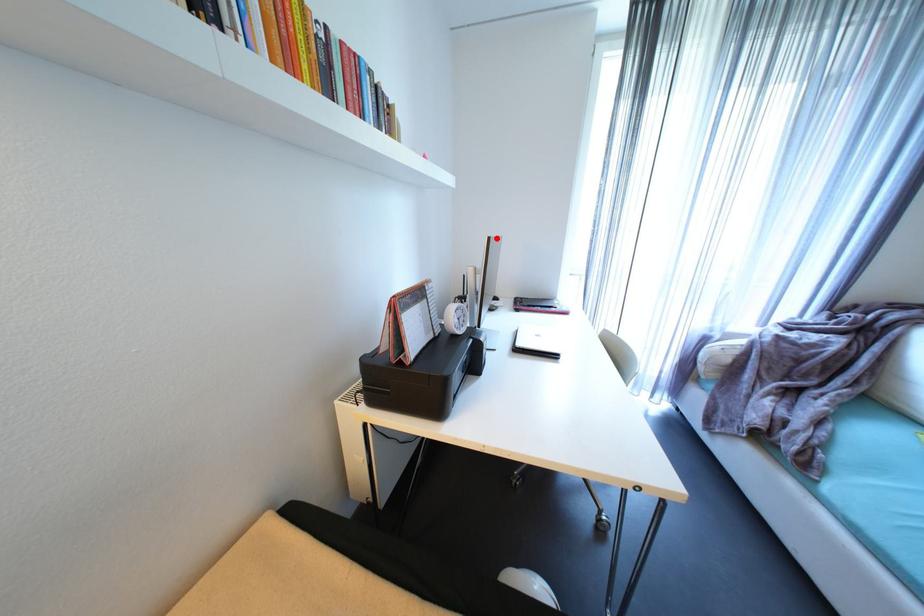
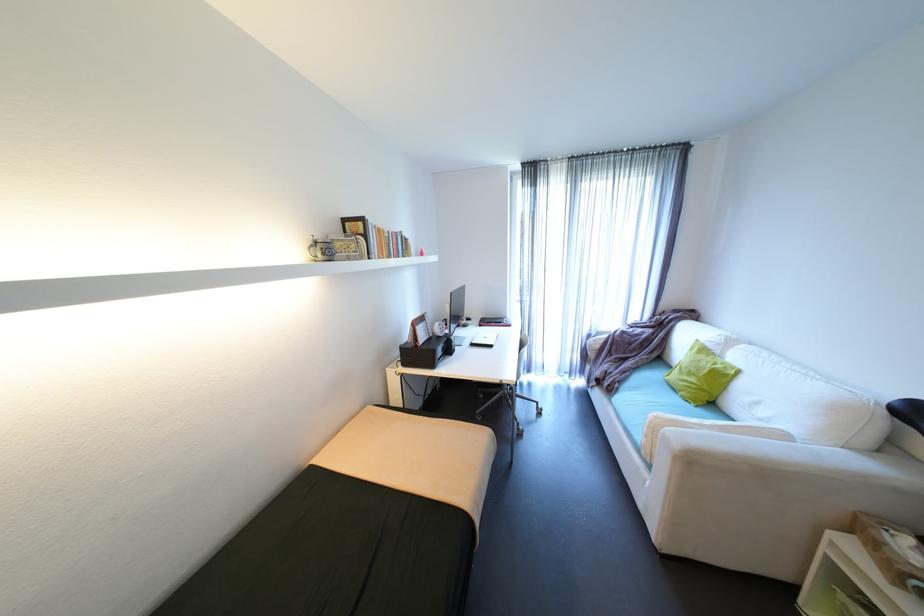
Where in the second image is the point corresponding to the highlighted location from the first image?

(458, 294)